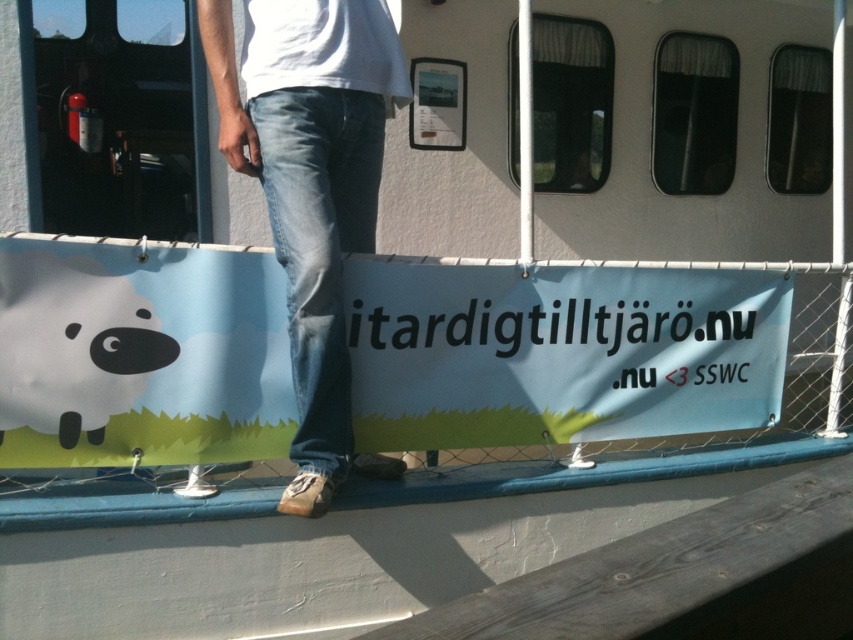
Question: Which object appears farthest from the camera in this image?

Choices:
 (A) denim at center
 (B) matte black sheep at lower left

Answer: (A)

Question: From the image, what is the correct spatial relationship of denim at center in relation to matte black sheep at lower left?

Choices:
 (A) above
 (B) below

Answer: (A)

Question: Does denim at center appear under matte black sheep at lower left?

Choices:
 (A) yes
 (B) no

Answer: (B)

Question: Does denim at center have a larger size compared to matte black sheep at lower left?

Choices:
 (A) no
 (B) yes

Answer: (B)